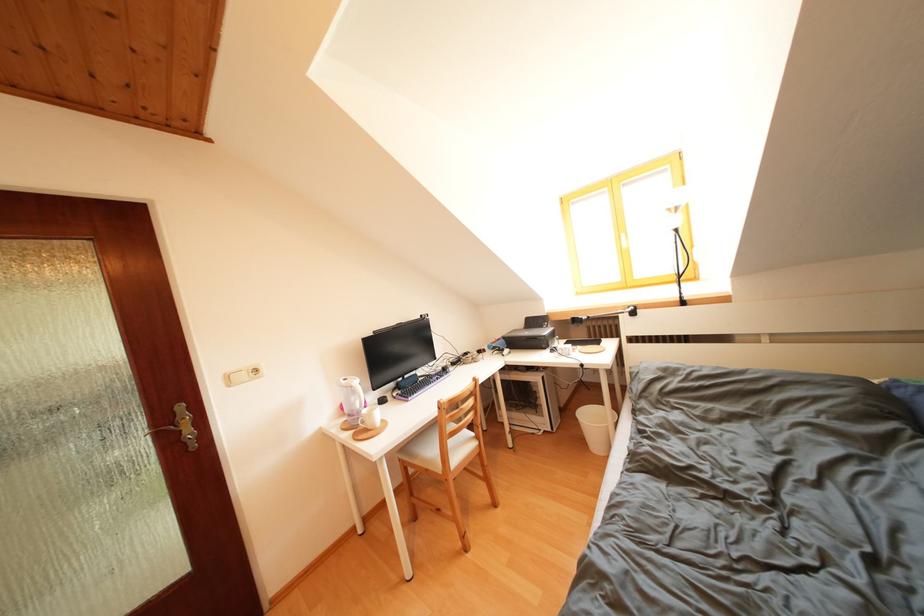
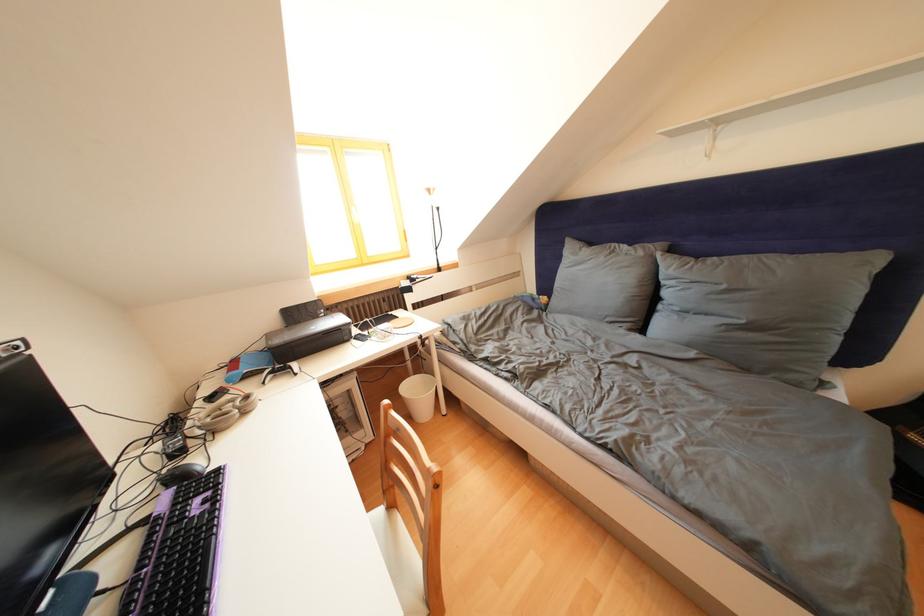
In the second image, find the point that corresponds to pixel 487 357 in the first image.

(220, 403)